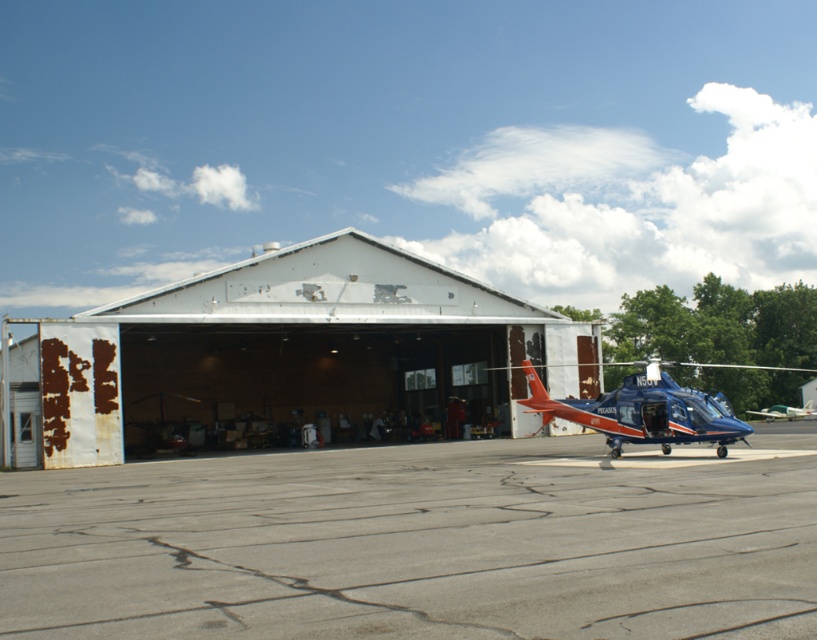
Question: Is gray concrete tarmac at center positioned before white matte hangar at center?

Choices:
 (A) yes
 (B) no

Answer: (A)

Question: Which of these objects is positioned closest to the blue metallic helicopter at center?

Choices:
 (A) white matte hangar at center
 (B) gray concrete tarmac at center

Answer: (B)

Question: Which object appears farthest from the camera in this image?

Choices:
 (A) blue metallic helicopter at center
 (B) gray concrete tarmac at center
 (C) white matte hangar at center

Answer: (C)

Question: Can you confirm if white matte hangar at center is smaller than blue metallic helicopter at center?

Choices:
 (A) yes
 (B) no

Answer: (B)

Question: Which of the following is the farthest from the observer?

Choices:
 (A) gray concrete tarmac at center
 (B) white matte hangar at center
 (C) blue metallic helicopter at center

Answer: (B)

Question: Is gray concrete tarmac at center behind white matte hangar at center?

Choices:
 (A) no
 (B) yes

Answer: (A)